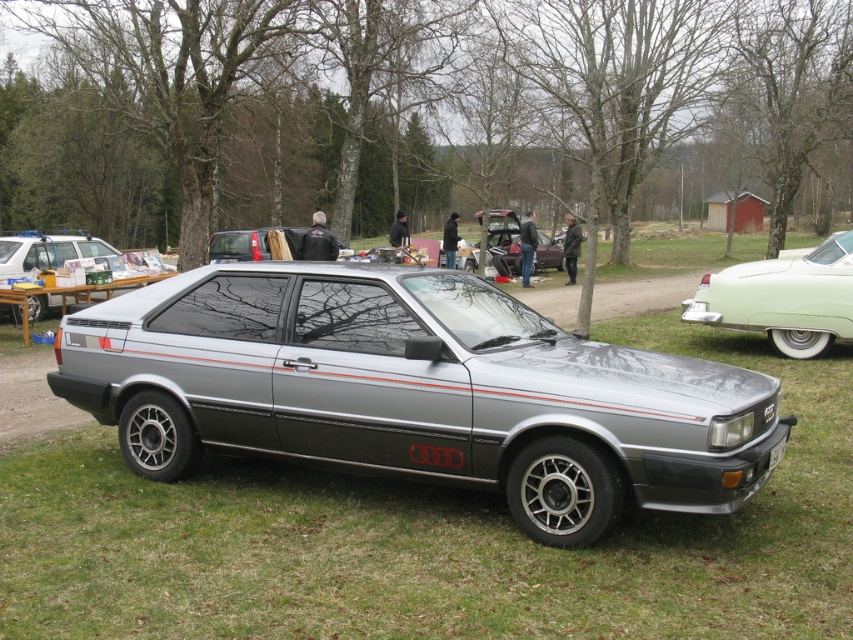
Question: Which point is closer to the camera?

Choices:
 (A) (779, 456)
 (B) (65, 234)

Answer: (A)

Question: Is satin silver car at center behind metallic silver car at center?

Choices:
 (A) yes
 (B) no

Answer: (B)

Question: Which of these objects is positioned closest to the satin metallic car at center?

Choices:
 (A) pastel green paintwork at center
 (B) metallic silver car at center
 (C) white plastic license plate at front
 (D) satin silver car at center

Answer: (C)

Question: Does pastel green paintwork at center have a lesser width compared to satin silver car at center?

Choices:
 (A) no
 (B) yes

Answer: (B)

Question: Which of the following is the farthest from the observer?

Choices:
 (A) white plastic license plate at front
 (B) satin metallic car at center
 (C) metallic silver car at center
 (D) pastel green paintwork at center

Answer: (C)

Question: Can you confirm if satin metallic car at center is positioned above pastel green paintwork at center?

Choices:
 (A) no
 (B) yes

Answer: (A)